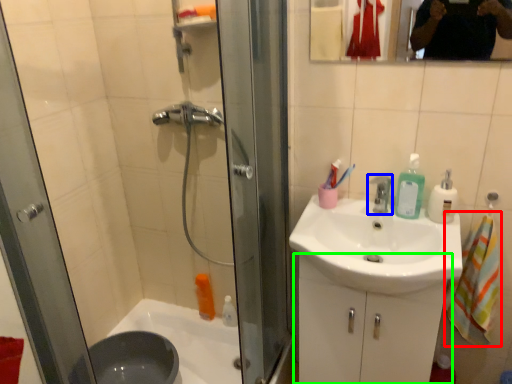
Question: Based on their relative distances, which object is farther from bath towel (highlighted by a red box)? Choose from tap (highlighted by a blue box) and bathroom cabinet (highlighted by a green box).

Choices:
 (A) tap
 (B) bathroom cabinet

Answer: (A)